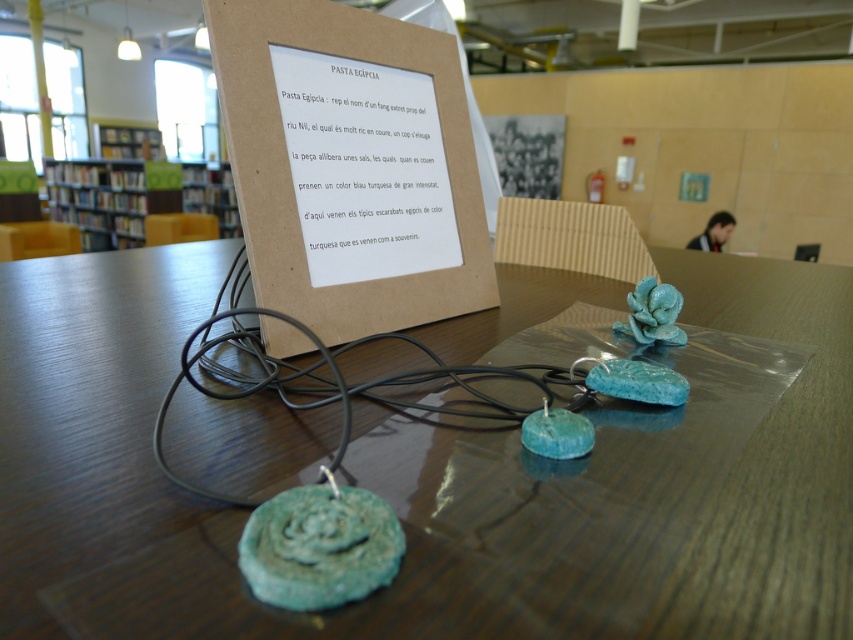
Who is shorter, shiny brown table at center or black wire at center?

black wire at center is shorter.

Is shiny brown table at center above black wire at center?

Yes, shiny brown table at center is above black wire at center.

Where is `shiny brown table at center`? This screenshot has width=853, height=640. shiny brown table at center is located at coordinates (407, 529).